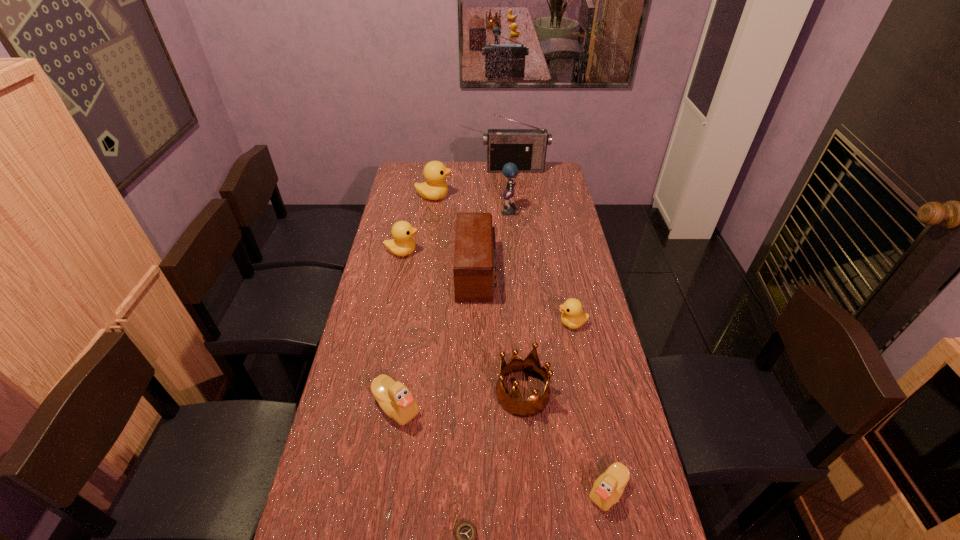
Locate an element on the screen. Image resolution: width=960 pixels, height=540 pixels. vacant space located on the face of the ninth nearest object is located at coordinates (494, 196).

Find the location of a particular element. Image resolution: width=960 pixels, height=540 pixels. vacant space located 0.050m on the front-facing side of the nearer radio receiver is located at coordinates (509, 273).

You are a GUI agent. You are given a task and a screenshot of the screen. Output one action in this format:
    pyautogui.click(x=<x>, y=<y>)
    Task: Click on the vacant area situated on the left of the crown
    
    Given the screenshot: What is the action you would take?
    (439, 393)

Identify the location of vacant area located 0.300m on the face of the fourth nearest duck. This screenshot has height=540, width=960. (492, 252).

Locate an element on the screen. vacant space located 0.150m at the beak of the farther beige duck is located at coordinates (385, 484).

The width and height of the screenshot is (960, 540). What are the coordinates of `free region located 0.260m on the face of the third nearest duck` in the screenshot? It's located at (482, 323).

The image size is (960, 540). What are the coordinates of `blank space located on the face of the third nearest duck` in the screenshot? It's located at (456, 323).

Where is `vacant space positioned on the face of the third nearest duck`? The height and width of the screenshot is (540, 960). vacant space positioned on the face of the third nearest duck is located at coordinates (459, 323).

This screenshot has height=540, width=960. I want to click on free region located at the beak of the smaller beige duck, so click(448, 491).

This screenshot has width=960, height=540. I want to click on vacant area situated 0.200m at the beak of the smaller beige duck, so click(508, 491).